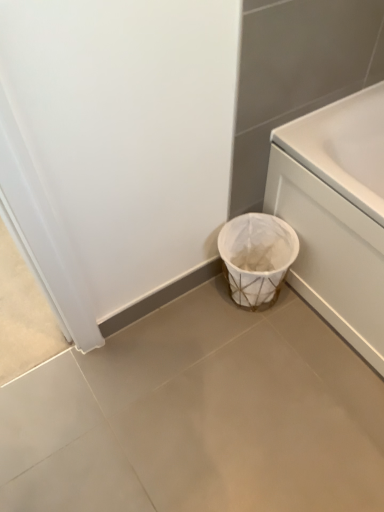
Question: Is white glossy bathtub at right with white matte trash can at lower right?

Choices:
 (A) no
 (B) yes

Answer: (A)

Question: From the image's perspective, does white glossy bathtub at right appear higher than white matte trash can at lower right?

Choices:
 (A) no
 (B) yes

Answer: (B)

Question: Is white glossy bathtub at right to the left of white matte trash can at lower right from the viewer's perspective?

Choices:
 (A) yes
 (B) no

Answer: (B)

Question: Is white glossy bathtub at right shorter than white matte trash can at lower right?

Choices:
 (A) no
 (B) yes

Answer: (A)

Question: Does white glossy bathtub at right have a smaller size compared to white matte trash can at lower right?

Choices:
 (A) yes
 (B) no

Answer: (B)

Question: Considering the relative sizes of white glossy bathtub at right and white matte trash can at lower right in the image provided, is white glossy bathtub at right thinner than white matte trash can at lower right?

Choices:
 (A) yes
 (B) no

Answer: (A)

Question: Is white woven basket at lower center beside white glossy bathtub at right?

Choices:
 (A) no
 (B) yes

Answer: (A)

Question: From a real-world perspective, is white woven basket at lower center located higher than white glossy bathtub at right?

Choices:
 (A) yes
 (B) no

Answer: (B)

Question: Can you confirm if white woven basket at lower center is bigger than white glossy bathtub at right?

Choices:
 (A) yes
 (B) no

Answer: (B)

Question: Can you confirm if white woven basket at lower center is thinner than white glossy bathtub at right?

Choices:
 (A) yes
 (B) no

Answer: (A)

Question: Does white woven basket at lower center appear on the left side of white glossy bathtub at right?

Choices:
 (A) yes
 (B) no

Answer: (A)

Question: Can you confirm if white woven basket at lower center is wider than white glossy bathtub at right?

Choices:
 (A) yes
 (B) no

Answer: (B)

Question: Considering the relative sizes of white glossy bathtub at right and white woven basket at lower center in the image provided, is white glossy bathtub at right smaller than white woven basket at lower center?

Choices:
 (A) yes
 (B) no

Answer: (B)